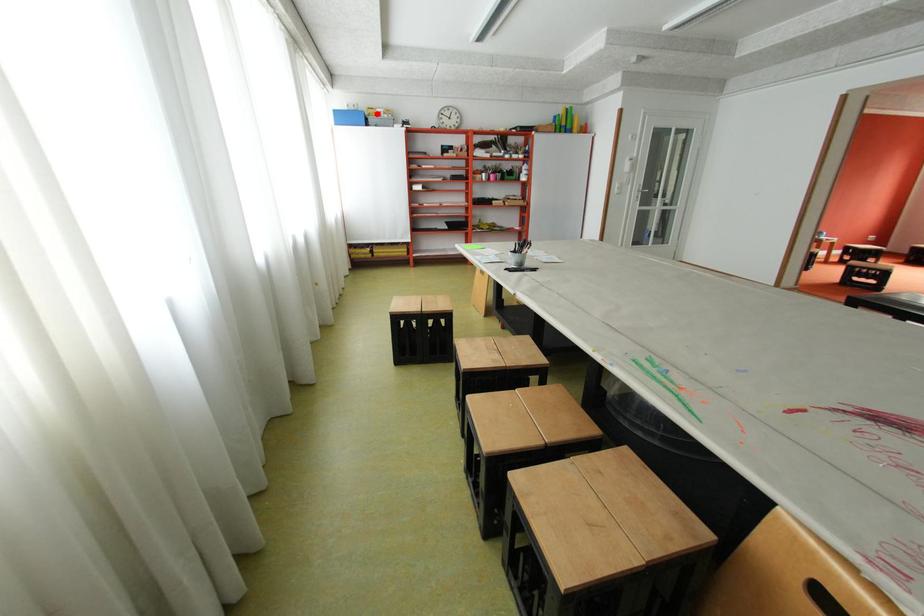
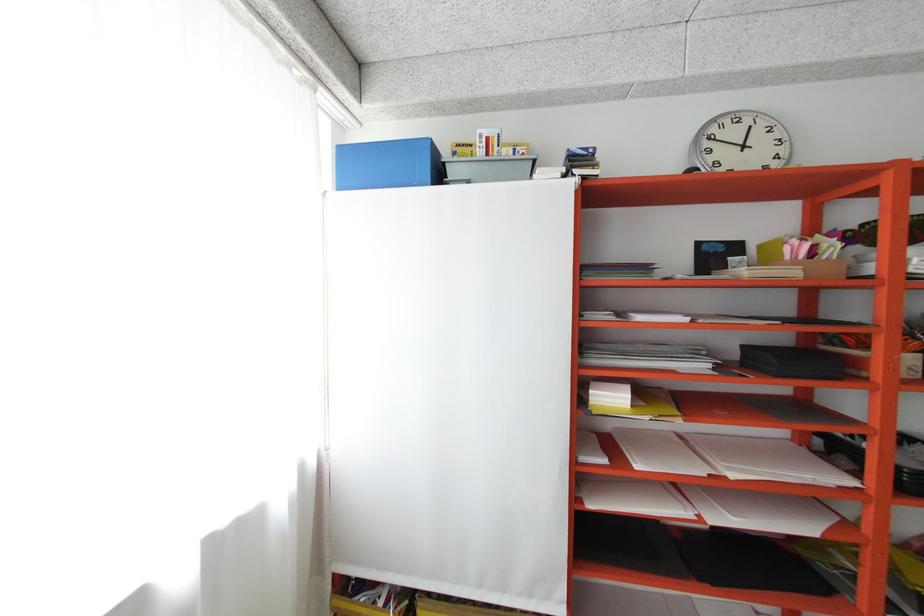
In the second image, find the point that corresponds to the highlighted location in the first image.

(456, 156)